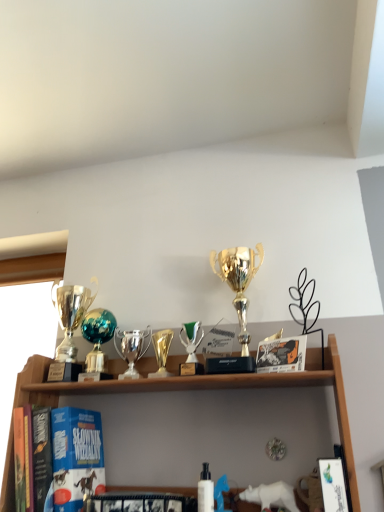
Question: From the image's perspective, relative to white glossy book at lower right, which is counted as the 2th book, starting from the back, is gold metallic trophy at center above or below?

Choices:
 (A) above
 (B) below

Answer: (A)

Question: Considering their positions, is gold metallic trophy at center located in front of or behind white glossy book at lower right, which is counted as the 2th book, starting from the back?

Choices:
 (A) behind
 (B) front

Answer: (A)

Question: Which of these objects is positioned closest to the gold shiny trophy at left, the 1th trophy in the left-to-right sequence?

Choices:
 (A) gold shiny trophy at center, which is the fifth trophy in left-to-right order
 (B) shiny silver trophy at center, the 3th trophy when ordered from right to left
 (C) green metallic trophy at center, the 4th trophy viewed from the left
 (D) hardcover book at center, which is counted as the first book, starting from the left
 (E) gold metallic trophy at center

Answer: (B)

Question: Estimate the real-world distances between objects in this image. Which object is closer to the hardcover book at center, the 2th book from the front?

Choices:
 (A) white matte bottle at center
 (B) shiny silver trophy at center, which is counted as the 3th trophy, starting from the left
 (C) gold shiny trophy at center, the 1th trophy in the right-to-left sequence
 (D) gold shiny trophy at left, the 1th trophy in the left-to-right sequence
 (E) green metallic trophy at center, the 4th trophy viewed from the left

Answer: (A)